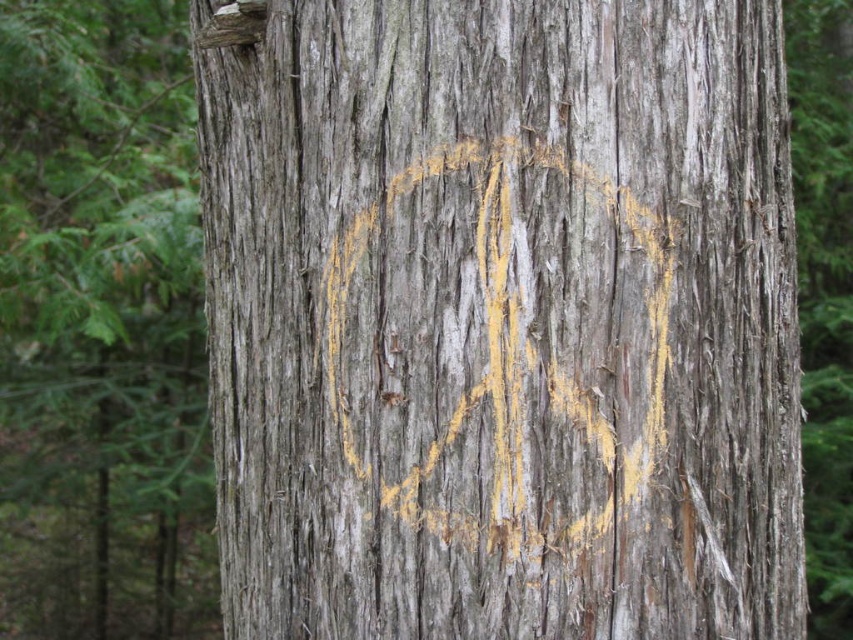
You are a hiker trying to follow a trail marked by two points on a tree trunk. The first point is at coordinate point (384,240), and the second is at point (78,180). If you are facing the tree, which point should you look at first to determine the direction of the trail?

Point (384,240) is in front of point (78,180), so you should look at point (384,240) first as it is closer to you.